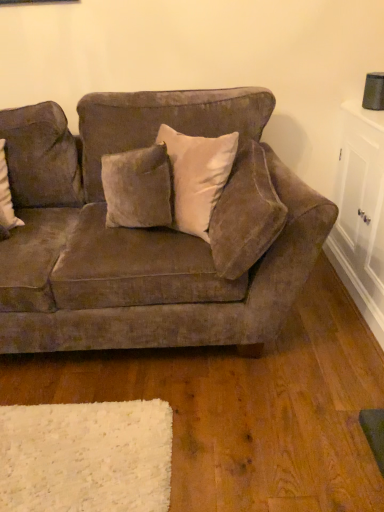
Question: From a real-world perspective, is velvet beige pillow at upper center physically below white glossy cabinet at right?

Choices:
 (A) no
 (B) yes

Answer: (A)

Question: From the image's perspective, does velvet beige pillow at upper center appear lower than white glossy cabinet at right?

Choices:
 (A) yes
 (B) no

Answer: (B)

Question: Would you say velvet beige pillow at upper center is outside white glossy cabinet at right?

Choices:
 (A) no
 (B) yes

Answer: (B)

Question: Does velvet beige pillow at upper center have a greater width compared to white glossy cabinet at right?

Choices:
 (A) no
 (B) yes

Answer: (A)

Question: Can you confirm if velvet beige pillow at upper center is thinner than white glossy cabinet at right?

Choices:
 (A) yes
 (B) no

Answer: (A)

Question: From a real-world perspective, relative to white glossy cabinet at right, is velvet brown couch at center vertically above or below?

Choices:
 (A) above
 (B) below

Answer: (A)

Question: From the image's perspective, is velvet brown couch at center above or below white glossy cabinet at right?

Choices:
 (A) above
 (B) below

Answer: (B)

Question: In terms of width, does velvet brown couch at center look wider or thinner when compared to white glossy cabinet at right?

Choices:
 (A) thin
 (B) wide

Answer: (B)

Question: Considering the positions of point (264, 273) and point (342, 258), is point (264, 273) closer or farther from the camera than point (342, 258)?

Choices:
 (A) farther
 (B) closer

Answer: (B)

Question: Considering the positions of point (264, 157) and point (264, 333), is point (264, 157) closer or farther from the camera than point (264, 333)?

Choices:
 (A) closer
 (B) farther

Answer: (B)

Question: Is velvet beige pillow at upper center wider or thinner than velvet brown couch at center?

Choices:
 (A) wide
 (B) thin

Answer: (B)

Question: Which is correct: velvet beige pillow at upper center is inside velvet brown couch at center, or outside of it?

Choices:
 (A) outside
 (B) inside

Answer: (B)

Question: In the image, is velvet beige pillow at upper center positioned in front of or behind velvet brown couch at center?

Choices:
 (A) front
 (B) behind

Answer: (A)

Question: From their relative heights in the image, would you say white glossy cabinet at right is taller or shorter than velvet beige pillow at upper center?

Choices:
 (A) short
 (B) tall

Answer: (B)

Question: Is white glossy cabinet at right in front of or behind velvet beige pillow at upper center in the image?

Choices:
 (A) behind
 (B) front

Answer: (A)